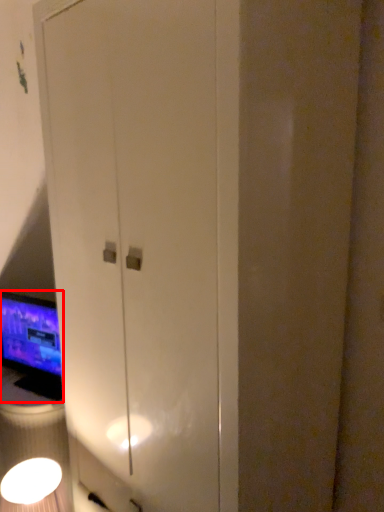
Question: From the image's perspective, what is the correct spatial positioning of computer monitor (annotated by the red box) in reference to light fixture?

Choices:
 (A) below
 (B) above

Answer: (B)